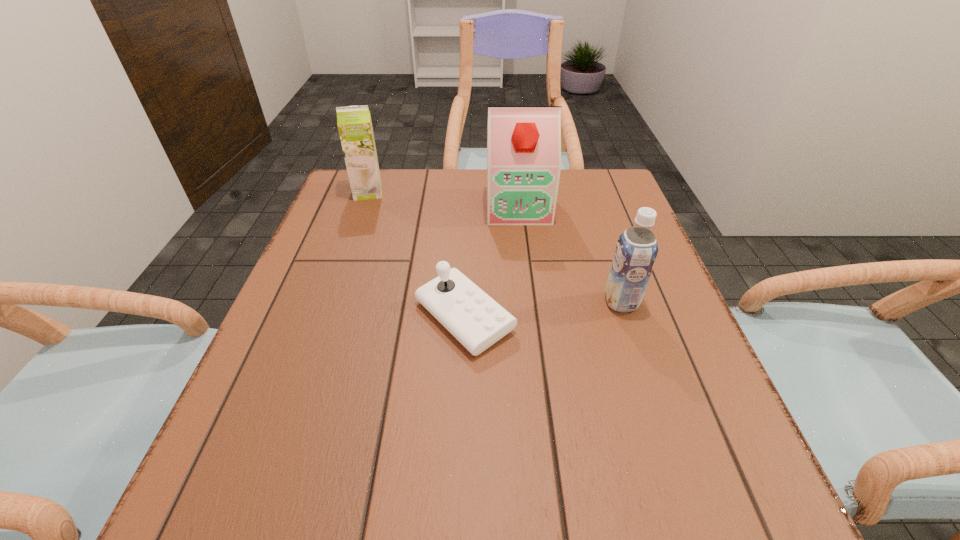
The width and height of the screenshot is (960, 540). In the image, there is a desktop. In order to click on vacant space at the near right corner in this screenshot , I will do tap(713, 498).

Find the location of a particular element. empty location between the nearest soya milk and the leftmost soya milk is located at coordinates coord(494,247).

At what (x,y) coordinates should I click in order to perform the action: click on empty space between the second soya milk from left to right and the leftmost soya milk. Please return your answer as a coordinate pair (x, y). This screenshot has width=960, height=540. Looking at the image, I should click on (444, 200).

At what (x,y) coordinates should I click in order to perform the action: click on free space between the rightmost soya milk and the leftmost object. Please return your answer as a coordinate pair (x, y). This screenshot has height=540, width=960. Looking at the image, I should click on (494, 247).

The height and width of the screenshot is (540, 960). I want to click on free point between the leftmost object and the joystick, so click(x=417, y=255).

Identify the location of free space between the leftmost object and the nearest soya milk. Image resolution: width=960 pixels, height=540 pixels. (494, 247).

Identify the location of free space between the nearest soya milk and the joystick. This screenshot has width=960, height=540. (542, 309).

I want to click on free space between the leftmost object and the second soya milk from right to left, so click(444, 200).

The image size is (960, 540). What are the coordinates of `empty space that is in between the second soya milk from right to left and the shortest object` in the screenshot? It's located at (492, 262).

Find the location of a particular element. This screenshot has width=960, height=540. free point between the second soya milk from left to right and the leftmost soya milk is located at coordinates (444, 200).